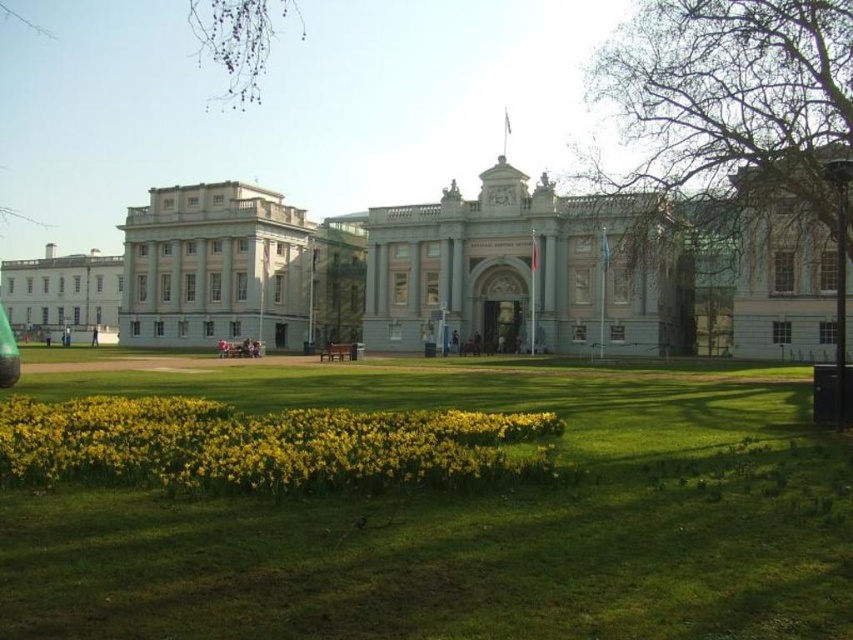
Question: Does green grass at lower center appear on the right side of yellow matte flowers at lower center?

Choices:
 (A) no
 (B) yes

Answer: (B)

Question: Which of the following is the farthest from the observer?

Choices:
 (A) (486, 195)
 (B) (285, 432)

Answer: (A)

Question: Can you confirm if smooth gray building at center is positioned to the left of yellow matte flowers at lower center?

Choices:
 (A) yes
 (B) no

Answer: (A)

Question: Among these objects, which one is farthest from the camera?

Choices:
 (A) green grass at lower center
 (B) yellow matte flowers at lower center

Answer: (B)

Question: Among these objects, which one is nearest to the camera?

Choices:
 (A) green grass at lower center
 (B) smooth gray building at center
 (C) yellow matte flowers at lower center

Answer: (A)

Question: Can you confirm if green grass at lower center is positioned to the right of yellow matte flowers at lower center?

Choices:
 (A) no
 (B) yes

Answer: (B)